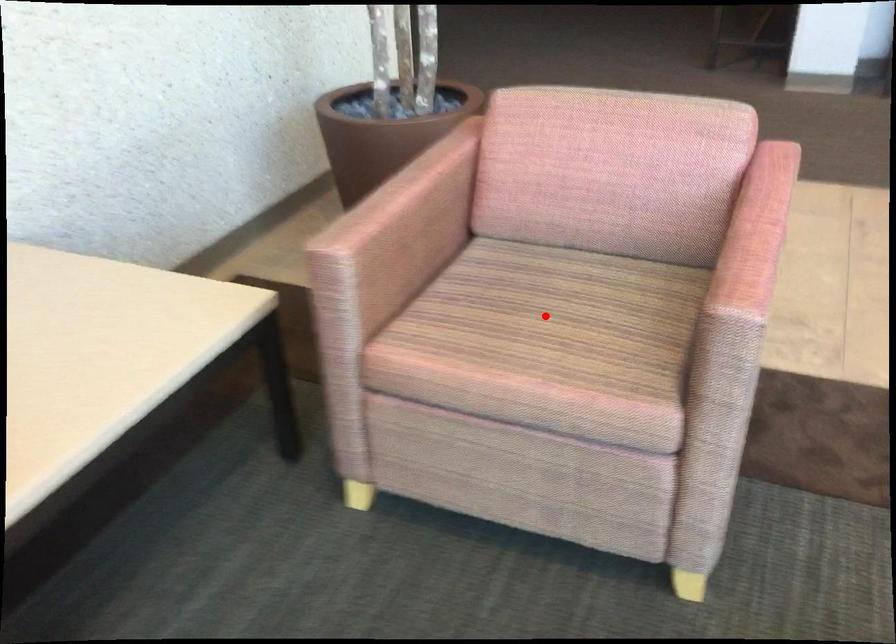
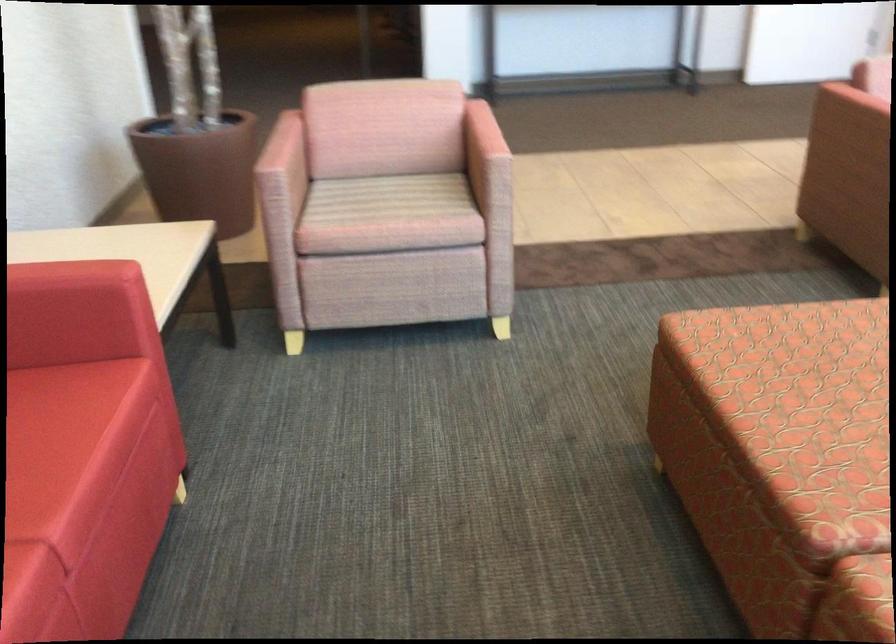
Question: A red point is marked in image1. In image2, is the corresponding 3D point closer to the camera or farther? Reply with the corresponding letter.

Choices:
 (A) The corresponding 3D point is closer.
 (B) The corresponding 3D point is farther.

Answer: (B)